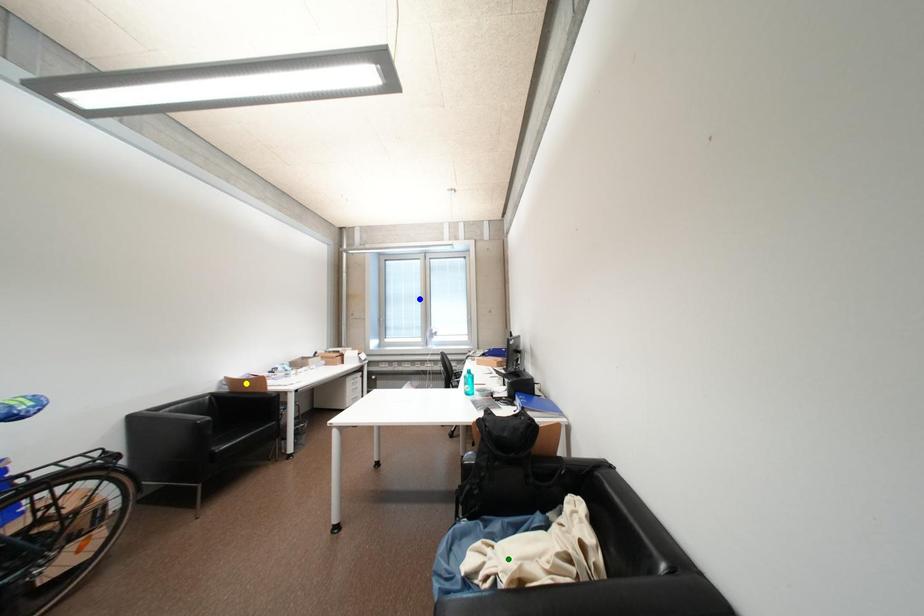
Order these from nearest to farthest:
- blue point
- yellow point
- green point

green point, yellow point, blue point